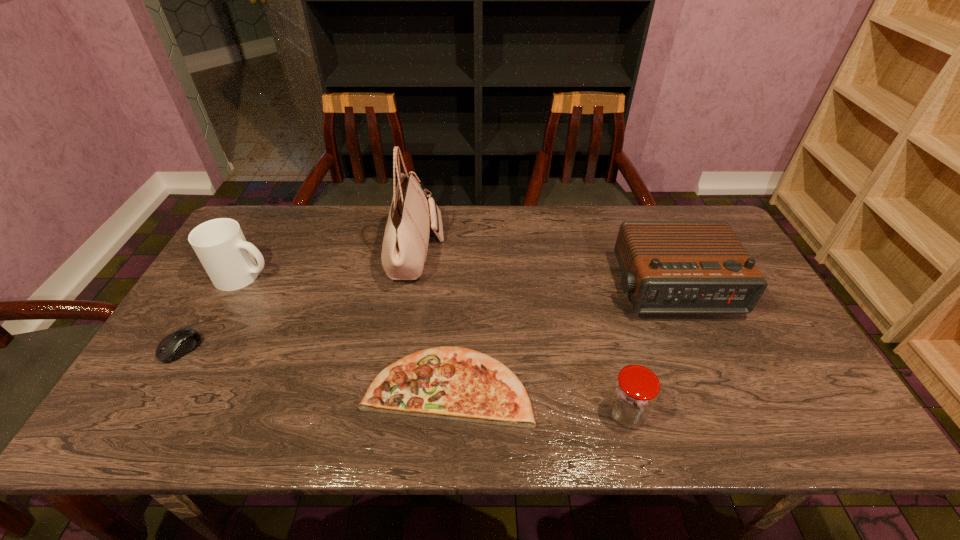
Locate an element on the screen. Image resolution: width=960 pixels, height=540 pixels. the tallest object is located at coordinates (405, 244).

Identify the location of radio receiver. The height and width of the screenshot is (540, 960). (668, 267).

Locate an element on the screen. mug is located at coordinates (220, 245).

Locate an element on the screen. the fourth tallest object is located at coordinates click(635, 390).

Image resolution: width=960 pixels, height=540 pixels. In order to click on the second object from right to left in this screenshot , I will do `click(635, 390)`.

Where is `mouse`? The height and width of the screenshot is (540, 960). mouse is located at coordinates (179, 343).

At what (x,y) coordinates should I click in order to perform the action: click on pizza. Please return your answer as a coordinate pair (x, y). The image size is (960, 540). Looking at the image, I should click on (454, 383).

I want to click on free region located 0.100m on the side of the tallest object with the attached pouch, so click(x=474, y=252).

The height and width of the screenshot is (540, 960). In order to click on vacant space located on the tuning display of the rightmost object in this screenshot , I will do `click(713, 387)`.

Locate an element on the screen. The width and height of the screenshot is (960, 540). free location located 0.370m on the handle side of the mug is located at coordinates (397, 275).